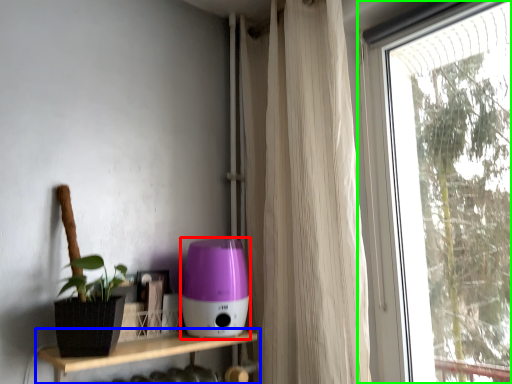
Question: Based on their relative distances, which object is farther from appliance (highlighted by a red box)? Choose from shelf (highlighted by a blue box) and window (highlighted by a green box).

Choices:
 (A) shelf
 (B) window

Answer: (B)